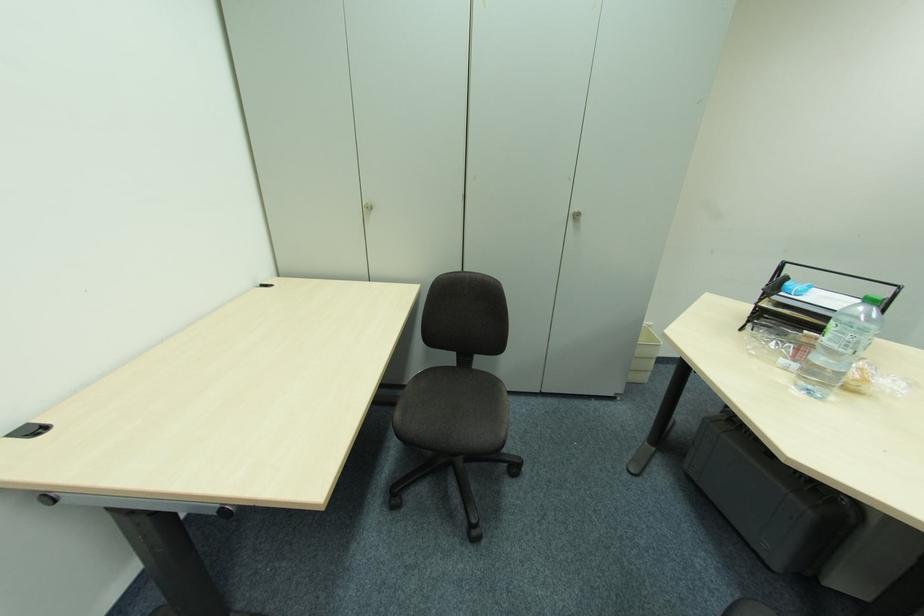
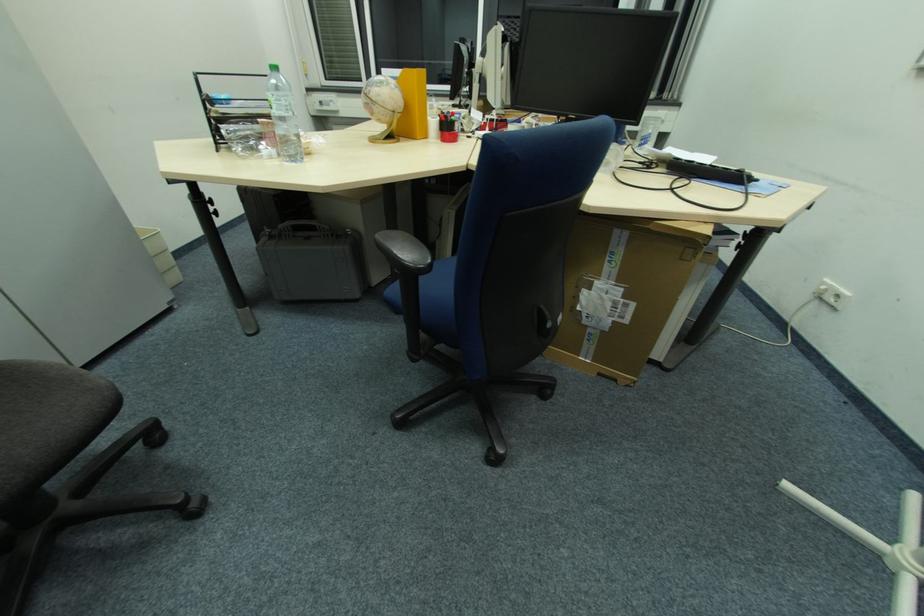
First-person continuous shooting, in which direction is the camera rotating?

The camera's rotation is toward right-down.